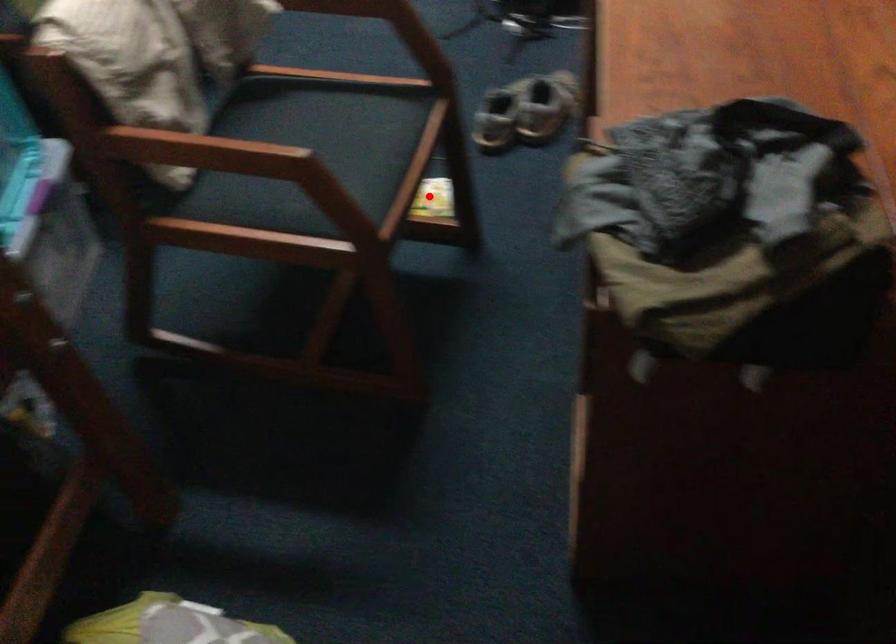
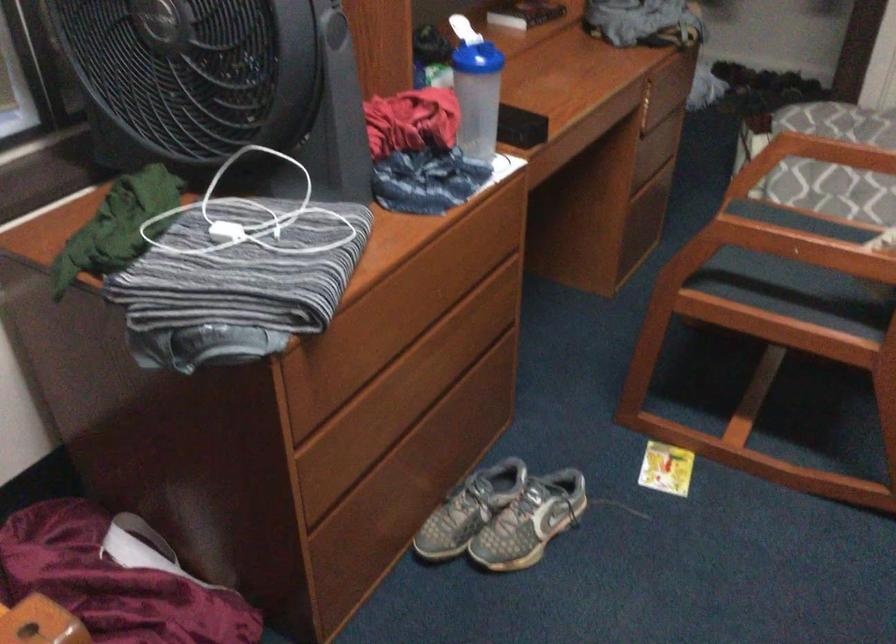
Question: I am providing you with two images of the same scene from different viewpoints. A red point is shown in image1. For the corresponding object point in image2, is it positioned nearer or farther from the camera?

Choices:
 (A) Nearer
 (B) Farther

Answer: (A)